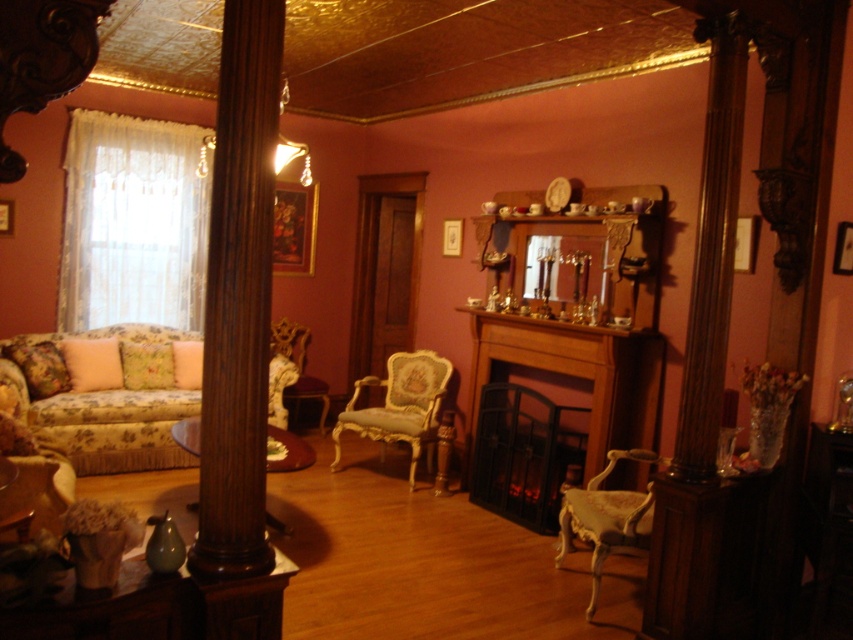
Where is `gold upholstered armchair at center`? This screenshot has height=640, width=853. gold upholstered armchair at center is located at coordinates (399, 404).

Does gold upholstered armchair at center appear on the right side of velvet gold armchair at lower left?

→ Indeed, gold upholstered armchair at center is positioned on the right side of velvet gold armchair at lower left.

Find the location of a particular element. gold upholstered armchair at center is located at coordinates (399, 404).

Locate an element on the screen. gold upholstered armchair at center is located at coordinates (399, 404).

Measure the distance between wooden fireplace at center and camera.

wooden fireplace at center is 4.04 meters away from camera.

Can you confirm if wooden fireplace at center is positioned above floral-patterned fabric couch at left?

No, wooden fireplace at center is not above floral-patterned fabric couch at left.

Locate an element on the screen. wooden fireplace at center is located at coordinates (564, 385).

Is gold upholstered armchair at center bigger than velvet purple armchair at center?

Yes.

Is point (436, 384) more distant than point (323, 432)?

No, it is in front of (323, 432).

Image resolution: width=853 pixels, height=640 pixels. I want to click on gold upholstered armchair at center, so click(x=399, y=404).